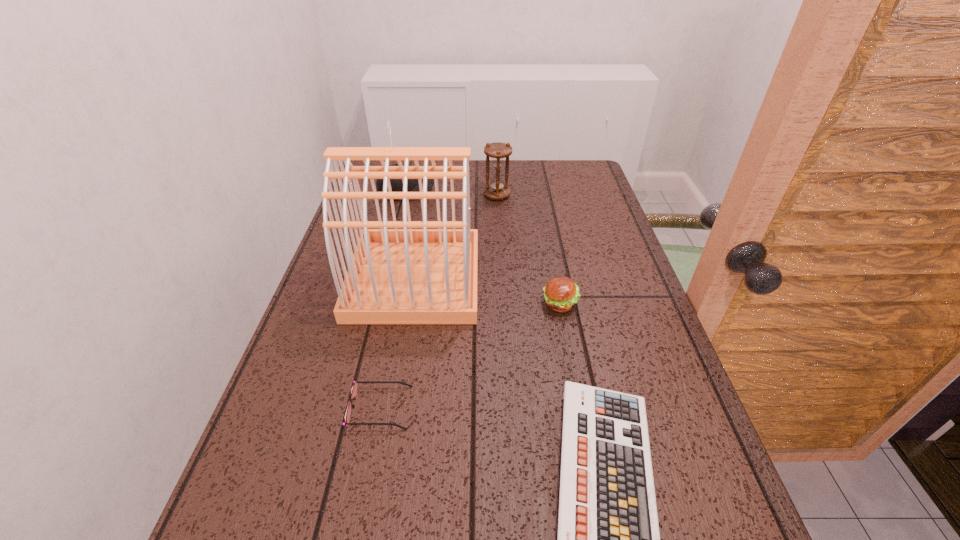
Locate an element on the screen. The image size is (960, 540). the tallest object is located at coordinates (396, 276).

In order to click on the fourth object from left to right in this screenshot , I will do `click(497, 189)`.

The height and width of the screenshot is (540, 960). In order to click on the fifth shortest object in this screenshot , I will do [497, 189].

This screenshot has height=540, width=960. In order to click on the fourth shortest object in this screenshot , I will do `click(396, 184)`.

This screenshot has width=960, height=540. I want to click on hamburger, so click(561, 293).

Find the location of `the fifth tallest object`. the fifth tallest object is located at coordinates (354, 389).

Locate an element on the screen. This screenshot has height=540, width=960. free point located 0.140m with an open door on the birdcage is located at coordinates (531, 278).

In order to click on blank space located on the right of the hourglass in this screenshot , I will do `click(543, 195)`.

Where is `vacant space positioned 0.090m on the front-facing side of the third tallest object`? vacant space positioned 0.090m on the front-facing side of the third tallest object is located at coordinates (464, 192).

You are a GUI agent. You are given a task and a screenshot of the screen. Output one action in this format:
    pyautogui.click(x=<x>, y=<y>)
    Task: Click on the vacant space located 0.050m on the front of the third shortest object
    
    Given the screenshot: What is the action you would take?
    pyautogui.click(x=565, y=333)